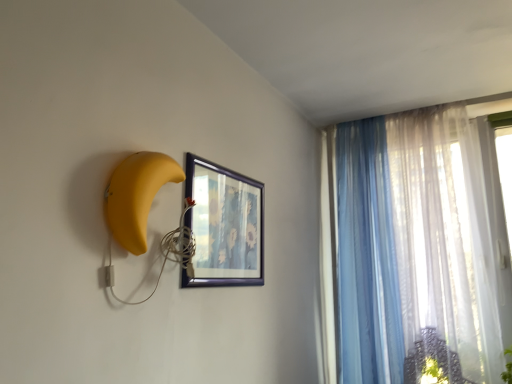
Question: Does translucent fabric curtain at right, which ranks as the 2th curtain in left-to-right order, appear on the left side of wooden framed picture at center?

Choices:
 (A) yes
 (B) no

Answer: (B)

Question: Can you see translucent fabric curtain at right, placed as the 1th curtain when sorted from right to left, touching wooden framed picture at center?

Choices:
 (A) yes
 (B) no

Answer: (B)

Question: Does translucent fabric curtain at right, which ranks as the 2th curtain in left-to-right order, have a larger size compared to wooden framed picture at center?

Choices:
 (A) yes
 (B) no

Answer: (A)

Question: Are translucent fabric curtain at right, placed as the 1th curtain when sorted from right to left, and wooden framed picture at center far apart?

Choices:
 (A) yes
 (B) no

Answer: (A)

Question: Is the depth of translucent fabric curtain at right, which ranks as the 2th curtain in left-to-right order, less than that of wooden framed picture at center?

Choices:
 (A) no
 (B) yes

Answer: (A)

Question: From a real-world perspective, is translucent fabric curtain at right, placed as the 1th curtain when sorted from right to left, above or below yellow matte banana at left?

Choices:
 (A) below
 (B) above

Answer: (A)

Question: From the image's perspective, is translucent fabric curtain at right, placed as the 1th curtain when sorted from right to left, located above or below yellow matte banana at left?

Choices:
 (A) above
 (B) below

Answer: (B)

Question: Would you say translucent fabric curtain at right, placed as the 1th curtain when sorted from right to left, is inside or outside yellow matte banana at left?

Choices:
 (A) inside
 (B) outside

Answer: (B)

Question: Is point (409, 114) positioned closer to the camera than point (129, 183)?

Choices:
 (A) closer
 (B) farther

Answer: (B)

Question: From the image's perspective, is yellow matte banana at left positioned above or below translucent blue curtain at upper right, acting as the 2th curtain starting from the right?

Choices:
 (A) above
 (B) below

Answer: (A)

Question: Is yellow matte banana at left inside or outside of translucent blue curtain at upper right, the 1th curtain viewed from the left?

Choices:
 (A) outside
 (B) inside

Answer: (A)

Question: Is yellow matte banana at left in front of or behind translucent blue curtain at upper right, the 1th curtain viewed from the left, in the image?

Choices:
 (A) behind
 (B) front

Answer: (B)

Question: From a real-world perspective, is yellow matte banana at left physically located above or below translucent blue curtain at upper right, acting as the 2th curtain starting from the right?

Choices:
 (A) below
 (B) above

Answer: (B)

Question: Is point (225, 177) closer or farther from the camera than point (485, 256)?

Choices:
 (A) farther
 (B) closer

Answer: (B)

Question: Relative to translucent fabric curtain at right, which ranks as the 2th curtain in left-to-right order, is wooden framed picture at center in front or behind?

Choices:
 (A) front
 (B) behind

Answer: (A)